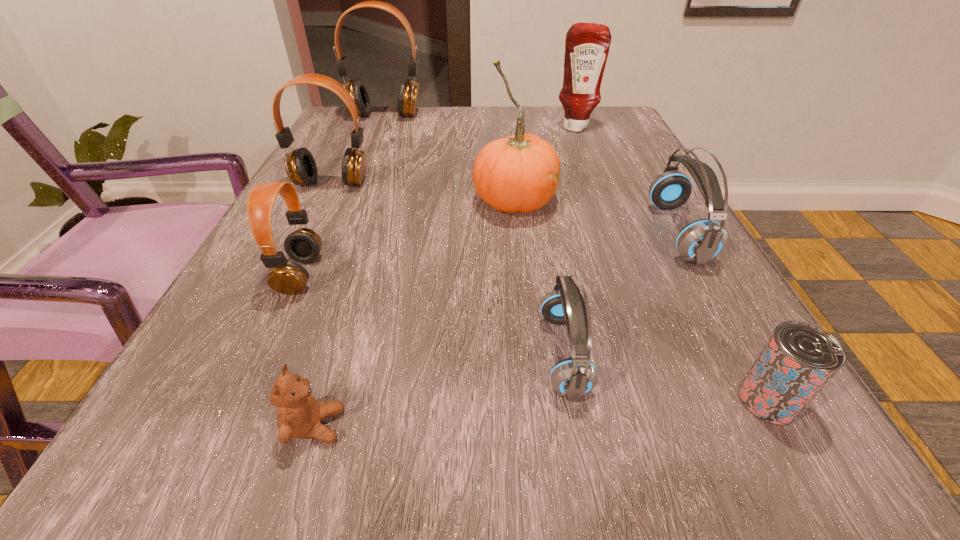
This screenshot has height=540, width=960. I want to click on the left blue headset, so click(x=574, y=377).

Where is `the nearer blue headset`? The height and width of the screenshot is (540, 960). the nearer blue headset is located at coordinates (574, 377).

Find the location of a particular element. The image size is (960, 540). beer can is located at coordinates (799, 359).

Image resolution: width=960 pixels, height=540 pixels. I want to click on brown teddy bear, so click(299, 414).

Identify the location of vacant space located 0.280m on the ear cups of the biggest brown headset. (360, 178).

Locate an element on the screen. vacant region located 0.210m on the left of the pumpkin is located at coordinates (363, 201).

I want to click on vacant space located 0.210m on the front of the red condiment, so click(594, 177).

The height and width of the screenshot is (540, 960). I want to click on vacant area situated 0.370m on the ear cups of the second tallest headset, so click(x=256, y=339).

The height and width of the screenshot is (540, 960). What are the coordinates of `vacant space located on the ear cups of the nearest brown headset` in the screenshot? It's located at (376, 274).

Find the location of a particular element. The width and height of the screenshot is (960, 540). free point located 0.350m on the ear cups of the bigger blue headset is located at coordinates (455, 233).